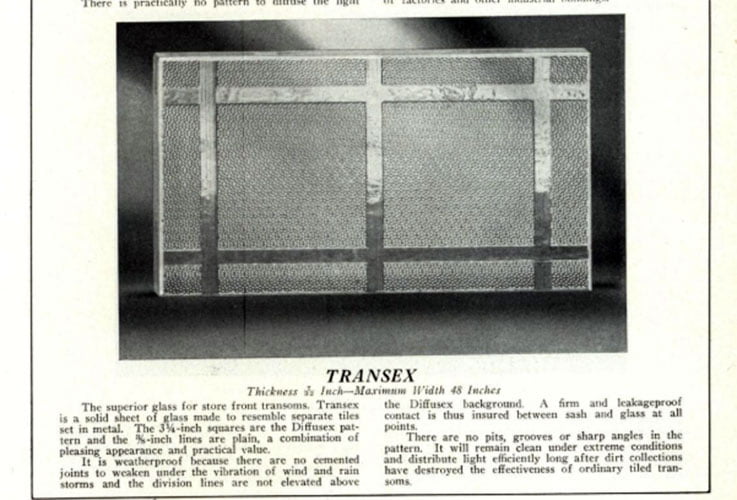
At what (x,y) coordinates should I click in order to perform the action: click on imitation tile. Please return your answer as a coordinate pair (x, y). Image resolution: width=737 pixels, height=500 pixels. Looking at the image, I should click on (290, 182).